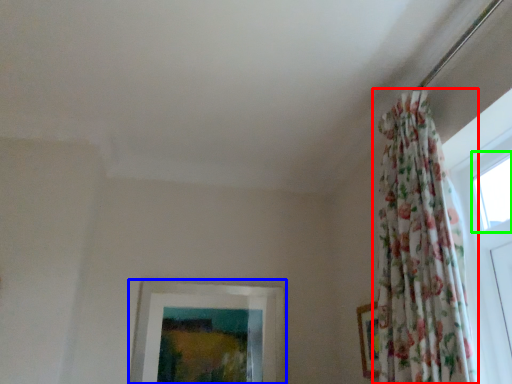
Question: Which is farther away from curtain (highlighted by a red box)? picture frame (highlighted by a blue box) or window (highlighted by a green box)?

Choices:
 (A) picture frame
 (B) window

Answer: (A)